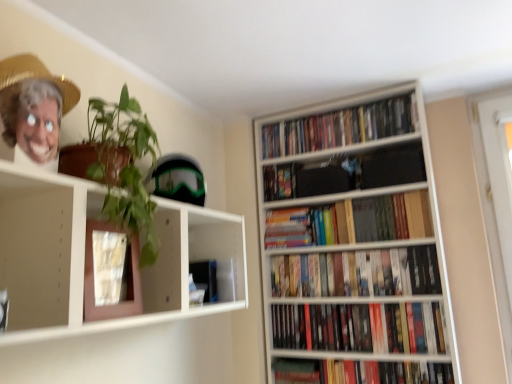
Question: From their relative heights in the image, would you say multicolored plastic toy at upper center, the 6th book positioned from the bottom, is taller or shorter than hardcover book at lower right, the first book in the bottom-to-top sequence?

Choices:
 (A) tall
 (B) short

Answer: (A)

Question: In terms of size, does multicolored plastic toy at upper center, the 6th book positioned from the bottom, appear bigger or smaller than hardcover book at lower right, acting as the 7th book starting from the top?

Choices:
 (A) small
 (B) big

Answer: (A)

Question: Which is nearer to the hardcover book at lower right, acting as the 7th book starting from the top?

Choices:
 (A) hardcover books at center, the 3th book when ordered from bottom to top
 (B) hardcover books at center, the 2th book positioned from the bottom
 (C) wooden bookshelf at right
 (D) green matte plant at upper left
 (E) hardcover books at center, placed as the 5th book when sorted from bottom to top

Answer: (B)

Question: Which is nearer to the hardcover books at center, the 5th book viewed from the top?

Choices:
 (A) hardcover books at center, arranged as the 6th book when viewed from the top
 (B) hardcover books at center, placed as the 5th book when sorted from bottom to top
 (C) green matte plant at upper left
 (D) multicolored plastic toy at upper center, placed as the second book when sorted from top to bottom
 (E) multicolored paperbacks at upper right, which appears as the 7th book when ordered from the bottom

Answer: (A)